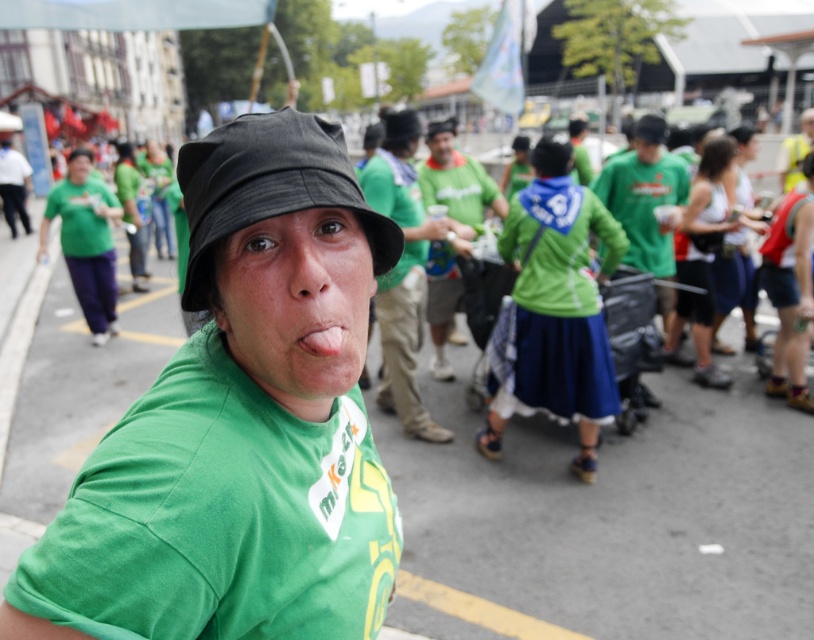
You are a photographer trying to capture the perfect shot of the green matte shirt at center and the pink flesh at center. Since you want both subjects to be clearly visible, which one should you zoom in on to ensure the smaller subject is in focus?

The pink flesh at center is smaller than the green matte shirt at center. To ensure the smaller subject is in focus, you should zoom in on the pink flesh at center.

You are a photographer at the event and want to capture a photo of the person with the green matte shirt at center and the pink flesh at center. Which object is positioned to the left of the other?

The green matte shirt at center is to the left of the pink flesh at center.

Based on the photo, you are a photographer trying to capture the black fabric hat at center in your shot. The camera you are using has a focal length of 50mm. If you want to ensure the hat is in focus, which part of the scene should you focus on?

The black fabric hat at center is located at point (268, 188), so you should focus on that point to ensure the hat is in focus.